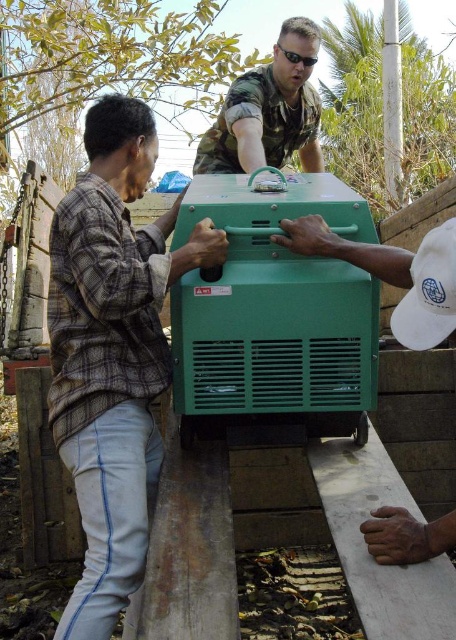
Please look at the image. There is a point marked at coordinates (274, 316). What object is located at this point?

The point at coordinates (274, 316) is located on the green plastic generator at center.

You are a safety inspector observing the moving of the generator. Which person, the one wearing the plaid fabric shirt at left or the camouflage fabric uniform at upper center, is positioned closer to the front of the generator?

The plaid fabric shirt at left is closer to the viewer than the camouflage fabric uniform at upper center, so the person in the plaid fabric shirt at left is positioned closer to the front of the generator.